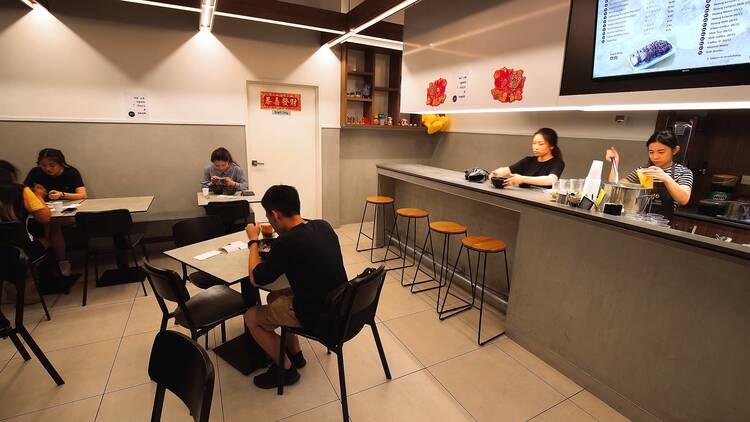
Locate an element on the screen. shelf is located at coordinates (x=358, y=70), (x=360, y=97), (x=367, y=122), (x=384, y=123), (x=384, y=90), (x=405, y=122).